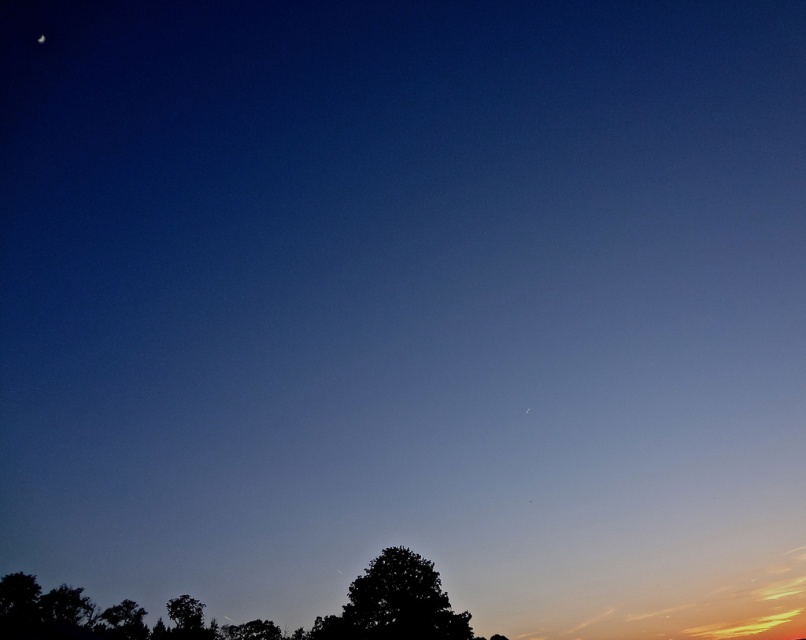
Consider the image. You are an astronomer observing the night sky. You notice the dark green leafy tree at lower center and the white glossy moon at upper left. Based on their positions, which object is closer to the eastern horizon?

The dark green leafy tree at lower center is to the right of the white glossy moon at upper left. Since the moon is in the upper left, it is closer to the eastern horizon compared to the tree, which is positioned to the right of the moon.

You are an astronomer observing the night sky. You notice the dark green leafy tree at lower center and the white glossy moon at upper left. Which object is located higher in the sky?

The white glossy moon at upper left is higher in the sky than the dark green leafy tree at lower center because the tree is positioned under the moon.

You are an astronomer observing the twilight sky. You notice two points of light in the image, one at point (381, 595) and another at point (40, 42). Which point is closer to you?

Point (381, 595) is closer to the viewer than point (40, 42).